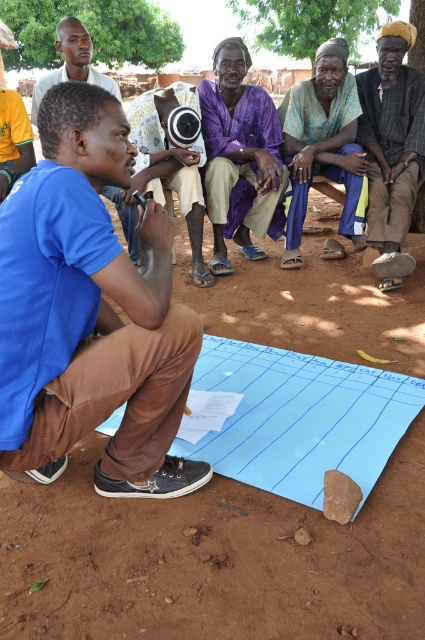
Which is in front, point (410, 202) or point (112, 81)?

Point (410, 202) is more forward.

Does brown woven cloth at right come in front of matte black shirt at upper left?

Yes, brown woven cloth at right is in front of matte black shirt at upper left.

I want to click on brown woven cloth at right, so click(x=391, y=148).

Does point (382, 51) lie behind point (277, 3)?

No, (382, 51) is closer to viewer.

Describe the element at coordinates (391, 148) in the screenshot. Image resolution: width=425 pixels, height=640 pixels. I see `brown woven cloth at right` at that location.

Which is behind, point (419, 92) or point (368, 38)?

Point (368, 38)

You are a GUI agent. You are given a task and a screenshot of the screen. Output one action in this format:
    pyautogui.click(x=<x>, y=<y>)
    Task: Click on the brown woven cloth at right
    Image resolution: width=425 pixels, height=640 pixels.
    Given the screenshot: What is the action you would take?
    pyautogui.click(x=391, y=148)

Who is positioned more to the right, green leafy tree at upper center or brown textured tree at upper right?

green leafy tree at upper center

Who is more forward, (x=362, y=28) or (x=413, y=19)?

Point (x=413, y=19)

Where is `green leafy tree at upper center`? green leafy tree at upper center is located at coordinates 311,22.